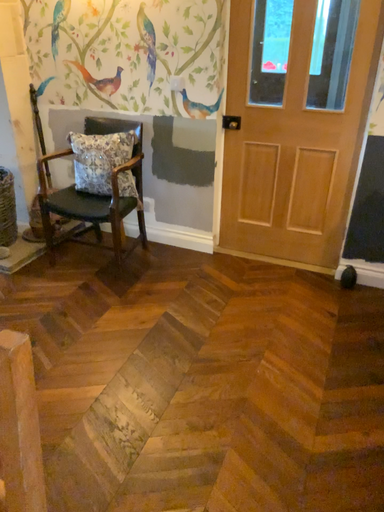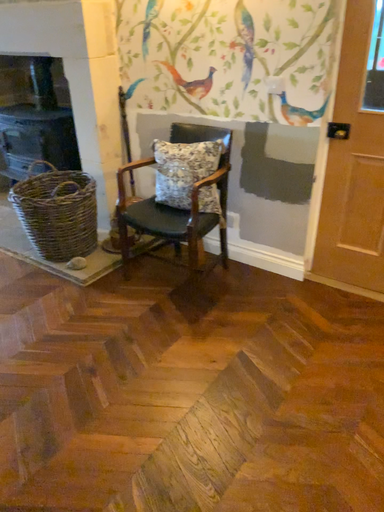
Question: Which way did the camera rotate in the video?

Choices:
 (A) rotated right
 (B) rotated left

Answer: (B)